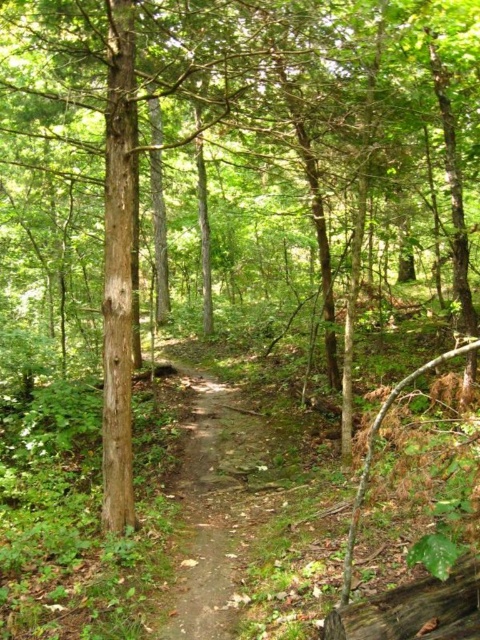
Question: Which point is closer to the camera?

Choices:
 (A) dirt path at center
 (B) brown rough log at lower right

Answer: (B)

Question: Which point appears farthest from the camera in this image?

Choices:
 (A) (186, 611)
 (B) (443, 637)

Answer: (A)

Question: Is dirt path at center positioned in front of brown rough log at lower right?

Choices:
 (A) no
 (B) yes

Answer: (A)

Question: Is dirt path at center below brown rough log at lower right?

Choices:
 (A) no
 (B) yes

Answer: (B)

Question: Can you confirm if dirt path at center is positioned to the left of brown rough log at lower right?

Choices:
 (A) yes
 (B) no

Answer: (A)